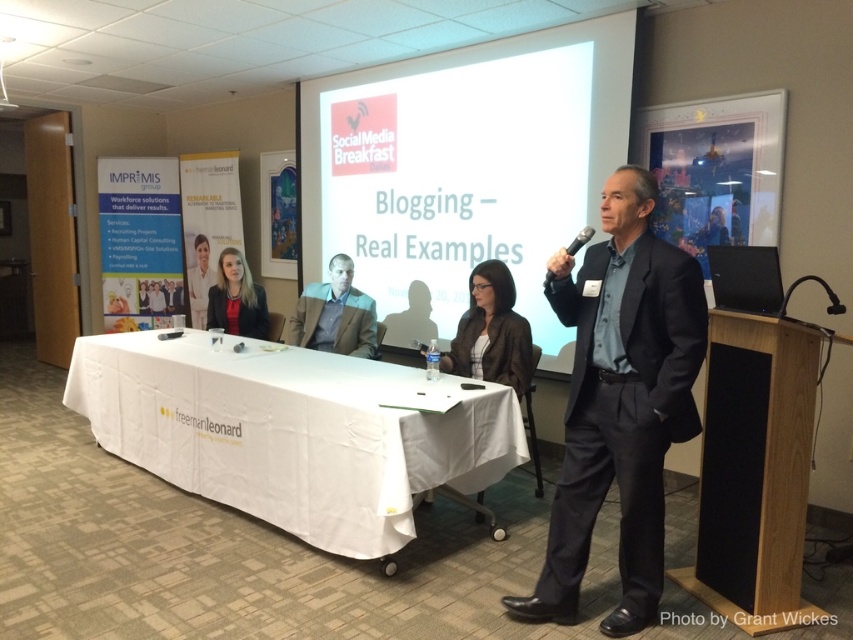
From the picture: You are organizing a charity event and need to seat two guests in chairs that are 1.2 meters apart. Given the dark blue suit at right and the matte black blazer at center, which guest should sit closer to the podium based on their clothing size?

The dark blue suit at right has a larger width than the matte black blazer at center, so the guest wearing the dark blue suit at right should sit closer to the podium to accommodate their larger size.

You are an attendee at the presentation. You need to determine which object is taller between the dark blue suit at right and the matte white shirt at center. Can you figure it out?

The dark blue suit at right is taller than the matte white shirt at center according to the description.